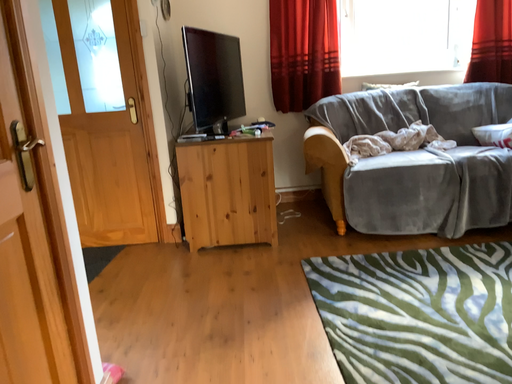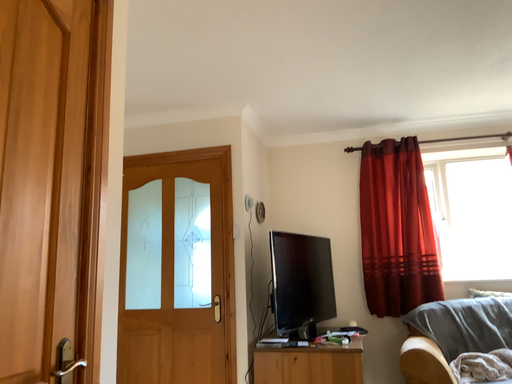
Question: Which way did the camera rotate in the video?

Choices:
 (A) rotated downward
 (B) rotated upward

Answer: (B)